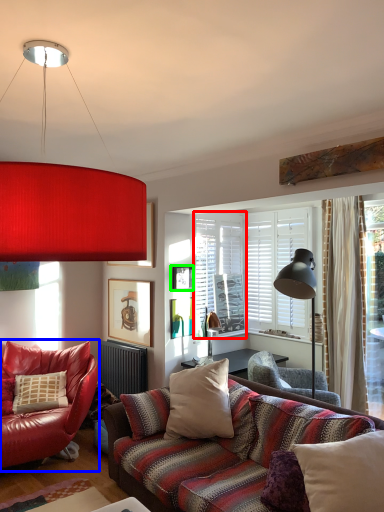
Question: Which object is the closest to the window screen (highlighted by a red box)? Choose among these: chair (highlighted by a blue box) or picture frame (highlighted by a green box).

Choices:
 (A) chair
 (B) picture frame

Answer: (B)